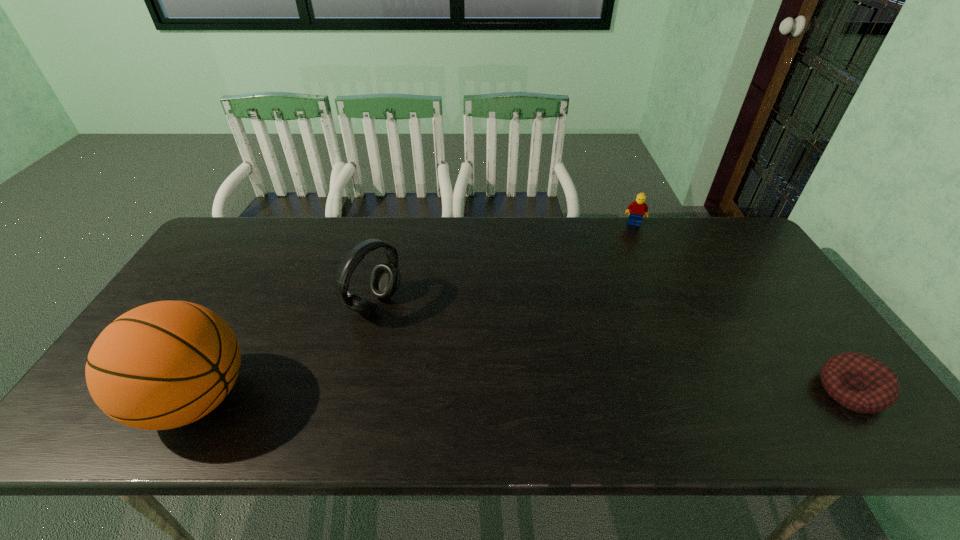
Locate an element on the screen. This screenshot has height=540, width=960. object that is at the right edge is located at coordinates (859, 382).

The width and height of the screenshot is (960, 540). Identify the location of object situated at the near left corner. (166, 364).

Where is `object that is at the near right corner`? This screenshot has height=540, width=960. object that is at the near right corner is located at coordinates (859, 382).

Where is `free space at the far edge`? Image resolution: width=960 pixels, height=540 pixels. free space at the far edge is located at coordinates (425, 219).

In the image, there is a desktop. Where is `free space at the near edge`? The width and height of the screenshot is (960, 540). free space at the near edge is located at coordinates (335, 382).

Identify the location of free space at the right edge. (761, 345).

In the image, there is a desktop. Find the location of `vacant space at the far left corner`. vacant space at the far left corner is located at coordinates (265, 220).

At what (x,y) coordinates should I click in order to perform the action: click on free space at the far right corner. Please return your answer as a coordinate pair (x, y). Looking at the image, I should click on (750, 255).

I want to click on vacant area that lies between the rightmost object and the farthest object, so click(x=742, y=307).

Locate an element on the screen. The height and width of the screenshot is (540, 960). unoccupied position between the second tallest object and the third object from left to right is located at coordinates (504, 264).